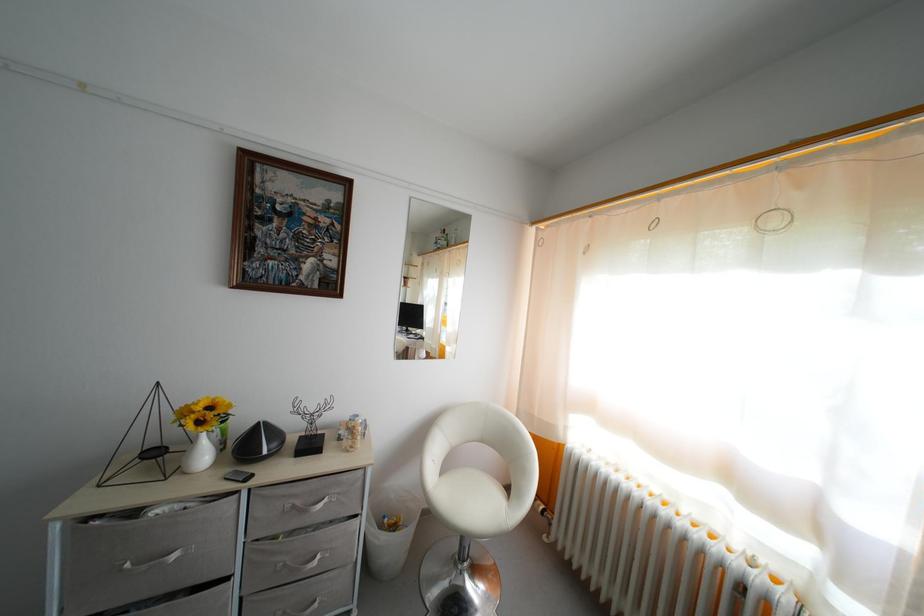
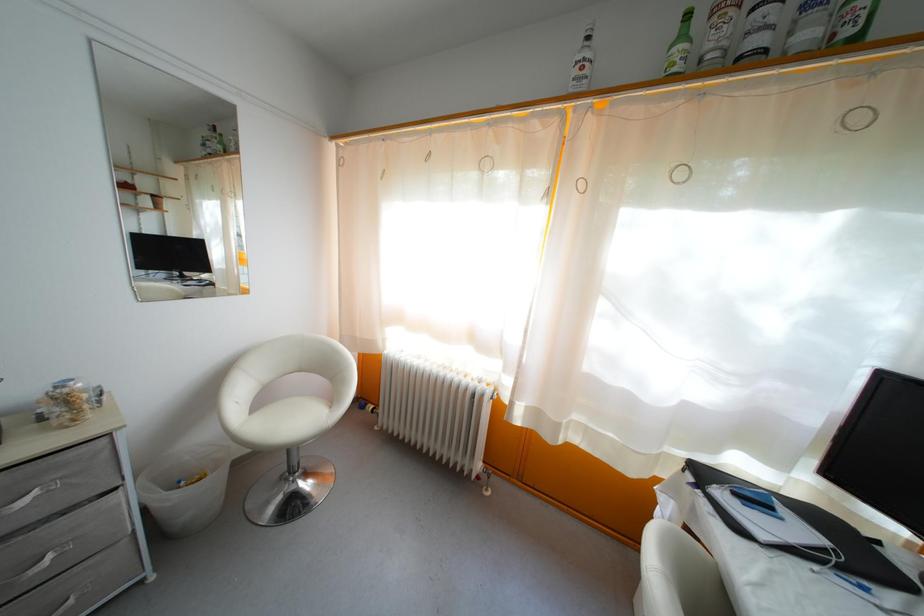
Locate, in the second image, the point that corresponds to (367,477) in the first image.

(110, 447)